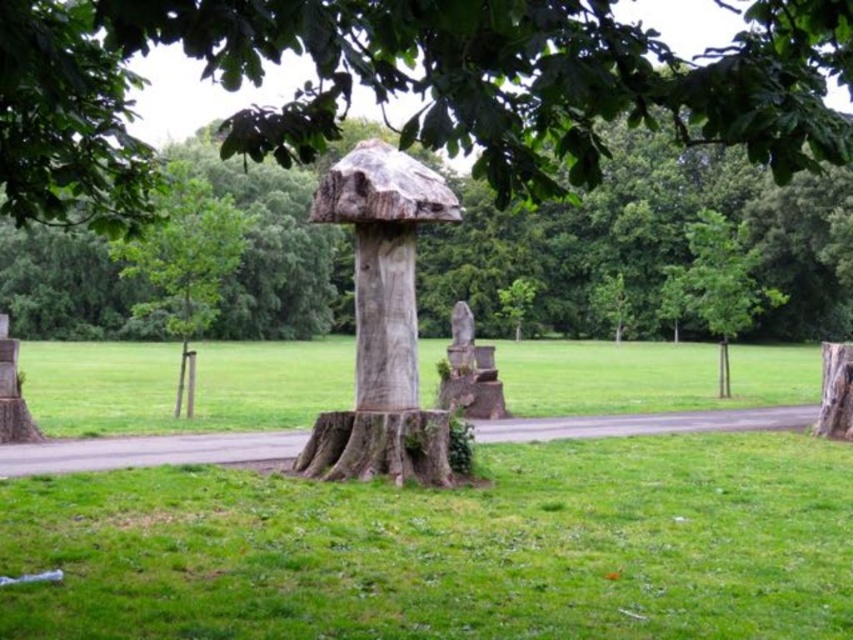
You are planning to place a small potted plant between the smooth wooden stump at center and the smooth gray stone statue at center. Which object should the plant be closer to if you want it to be near the wider base?

The smooth wooden stump at center has a larger width than the smooth gray stone statue at center, so the plant should be placed closer to the smooth wooden stump at center to be near the wider base.

You are standing in the park and see the green grass at center and the green wood tree at center. Which one is located to the right of the other?

The green grass at center is to the right of the green wood tree at center.